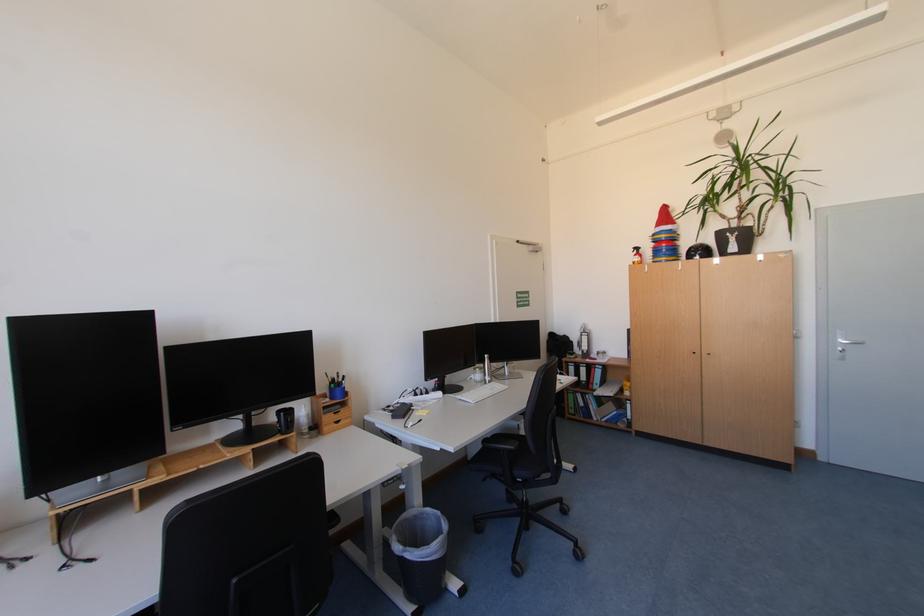
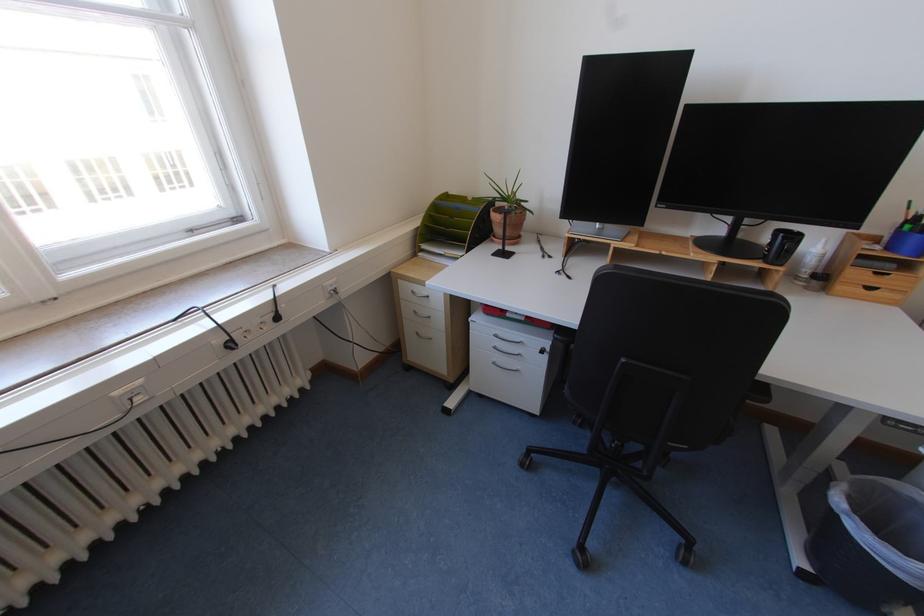
Find the pixel in the second image that matches pixel 286 436 in the first image.

(769, 262)